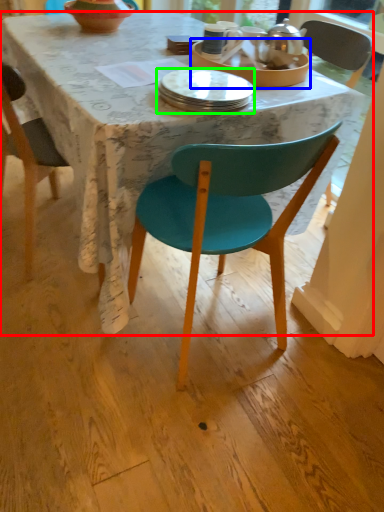
Question: Considering the real-world distances, which object is closest to desk (highlighted by a red box)? tableware (highlighted by a blue box) or plate (highlighted by a green box).

Choices:
 (A) tableware
 (B) plate

Answer: (B)